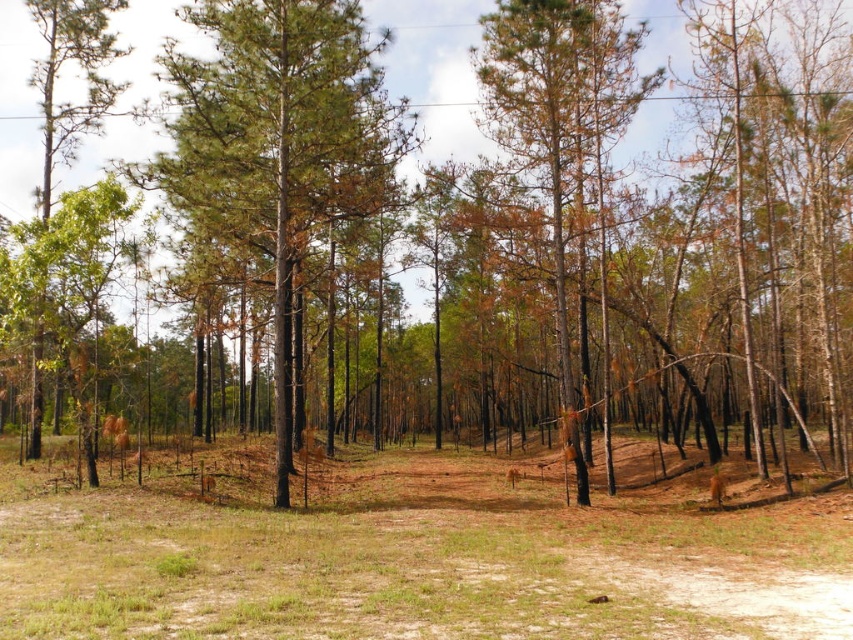
Can you confirm if brown dirt field at center is taller than brown bark tree at center?

No, brown dirt field at center is not taller than brown bark tree at center.

Who is more distant from viewer, (437, 557) or (555, 17)?

The point (555, 17) is more distant.

Locate an element on the screen. brown dirt field at center is located at coordinates (421, 566).

Can you confirm if green matte tree at center is positioned below green matte tree at left?

Correct, green matte tree at center is located below green matte tree at left.

Based on the photo, is green matte tree at center above green matte tree at left?

No.

Between point (219, 227) and point (32, 369), which one is positioned behind?

The point (32, 369) is behind.

Image resolution: width=853 pixels, height=640 pixels. I want to click on green matte tree at center, so pyautogui.click(x=277, y=145).

Does point (782, 552) come behind point (259, 176)?

No, (782, 552) is closer to viewer.

Is point (224, 531) in front of point (245, 28)?

Yes, it is in front of point (245, 28).

Is point (750, 516) positioned after point (206, 172)?

No, (750, 516) is in front of (206, 172).

This screenshot has width=853, height=640. I want to click on brown dirt field at center, so click(x=421, y=566).